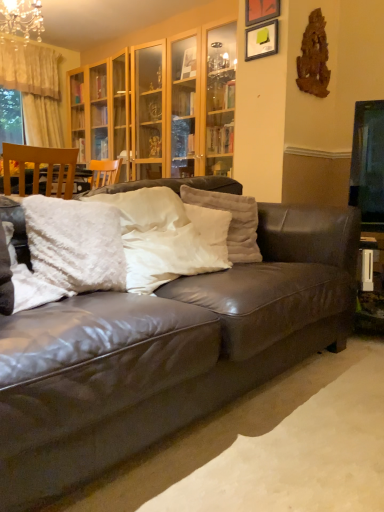
Question: Can you confirm if white fluffy pillow at center, which is counted as the first pillow, starting from the right, is taller than crystal glass chandelier at upper left?

Choices:
 (A) no
 (B) yes

Answer: (A)

Question: Is white fluffy pillow at center, which is counted as the first pillow, starting from the right, located outside crystal glass chandelier at upper left?

Choices:
 (A) yes
 (B) no

Answer: (A)

Question: Is white fluffy pillow at center, acting as the 4th pillow starting from the left, behind crystal glass chandelier at upper left?

Choices:
 (A) yes
 (B) no

Answer: (B)

Question: Is white fluffy pillow at center, which is counted as the first pillow, starting from the right, thinner than crystal glass chandelier at upper left?

Choices:
 (A) no
 (B) yes

Answer: (B)

Question: Is crystal glass chandelier at upper left completely or partially inside white fluffy pillow at center, acting as the 4th pillow starting from the left?

Choices:
 (A) no
 (B) yes

Answer: (A)

Question: In terms of height, does white fluffy pillow at center, the 2th pillow when ordered from left to right, look taller or shorter compared to matte wooden picture frame at upper center, placed as the 2th picture frame when sorted from bottom to top?

Choices:
 (A) tall
 (B) short

Answer: (A)

Question: From a real-world perspective, is white fluffy pillow at center, the 2th pillow when ordered from left to right, positioned above or below matte wooden picture frame at upper center, which appears as the first picture frame when viewed from the top?

Choices:
 (A) above
 (B) below

Answer: (B)

Question: Considering the positions of white fluffy pillow at center, the third pillow positioned from the right, and matte wooden picture frame at upper center, which appears as the first picture frame when viewed from the top, in the image, is white fluffy pillow at center, the third pillow positioned from the right, wider or thinner than matte wooden picture frame at upper center, which appears as the first picture frame when viewed from the top,?

Choices:
 (A) wide
 (B) thin

Answer: (A)

Question: Which is correct: white fluffy pillow at center, the 2th pillow when ordered from left to right, is inside matte wooden picture frame at upper center, placed as the 2th picture frame when sorted from bottom to top, or outside of it?

Choices:
 (A) inside
 (B) outside

Answer: (B)

Question: Would you say crystal glass chandelier at upper left is inside or outside matte black picture frame at upper center, which ranks as the second picture frame in top-to-bottom order?

Choices:
 (A) inside
 (B) outside

Answer: (B)

Question: From a real-world perspective, relative to matte black picture frame at upper center, which ranks as the first picture frame in bottom-to-top order, is crystal glass chandelier at upper left vertically above or below?

Choices:
 (A) above
 (B) below

Answer: (A)

Question: Considering the positions of crystal glass chandelier at upper left and matte black picture frame at upper center, which ranks as the second picture frame in top-to-bottom order, in the image, is crystal glass chandelier at upper left wider or thinner than matte black picture frame at upper center, which ranks as the second picture frame in top-to-bottom order,?

Choices:
 (A) thin
 (B) wide

Answer: (B)

Question: Does point (4, 31) appear closer or farther from the camera than point (264, 25)?

Choices:
 (A) farther
 (B) closer

Answer: (A)

Question: From their relative heights in the image, would you say white fluffy pillow at center, arranged as the second pillow when viewed from the right, is taller or shorter than white fluffy pillow at center, the 4th pillow from the right?

Choices:
 (A) tall
 (B) short

Answer: (A)

Question: Which is correct: white fluffy pillow at center, which ranks as the third pillow in left-to-right order, is inside white fluffy pillow at center, the 4th pillow from the right, or outside of it?

Choices:
 (A) outside
 (B) inside

Answer: (A)